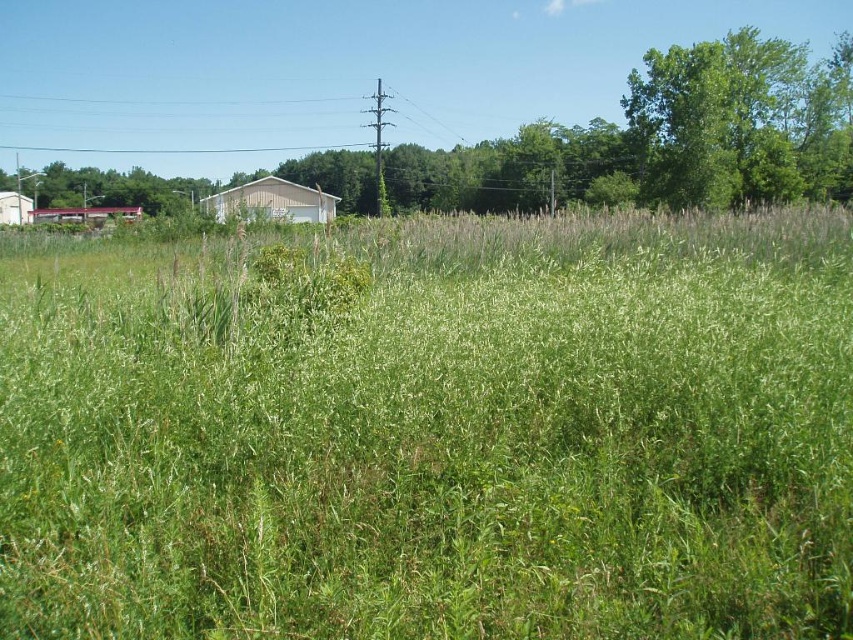
You are standing in a rural area and see the white matte barn at center. If you want to reach the barn within 2 minutes, what is the minimum speed you need to walk at?

The white matte barn at center is 48.34 meters away. To reach it in 2 minutes, you need to walk at a minimum speed of 4.03 meters per minute.

You are a farmer planning to plant crops in the green grassy field at left and the white matte barn at center. Which area has more space available for planting?

The green grassy field at left has more space available for planting because it is larger in size than the white matte barn at center.